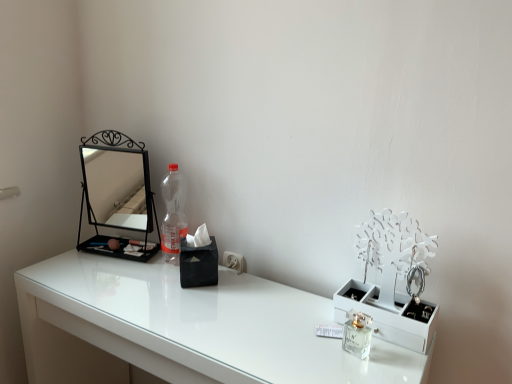
Identify the location of free space in front of clear glass perfume at center. The width and height of the screenshot is (512, 384). (356, 367).